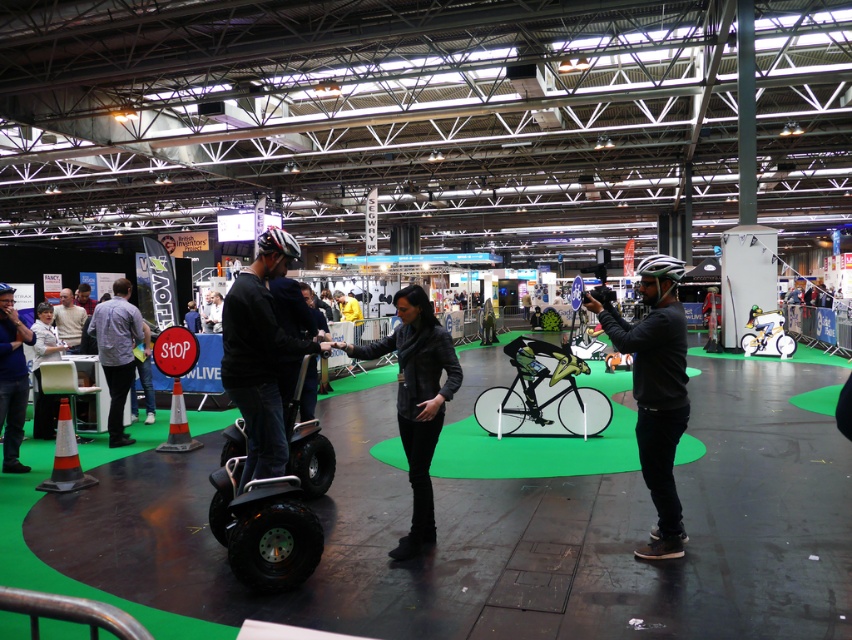
Question: Is dark gray sweatshirt at center thinner than dark blue jacket at center?

Choices:
 (A) yes
 (B) no

Answer: (B)

Question: Is black rubber segway at center to the left of white fabric jacket at left from the viewer's perspective?

Choices:
 (A) yes
 (B) no

Answer: (B)

Question: Based on their relative distances, which object is nearer to the dark gray sweatshirt at center?

Choices:
 (A) black rubber segway at center
 (B) black leather jacket at center
 (C) white fabric jacket at left

Answer: (B)

Question: Which of the following is the closest to the observer?

Choices:
 (A) light blue shirt at center
 (B) black matte segway at center
 (C) white fabric jacket at left

Answer: (B)

Question: Considering the relative positions of black rubber segway at center and black leather jacket at center in the image provided, where is black rubber segway at center located with respect to black leather jacket at center?

Choices:
 (A) below
 (B) above

Answer: (A)

Question: Which point is farther from the camera taking this photo?

Choices:
 (A) (10, 305)
 (B) (668, 374)
 (C) (410, 298)
 (D) (113, 291)

Answer: (D)